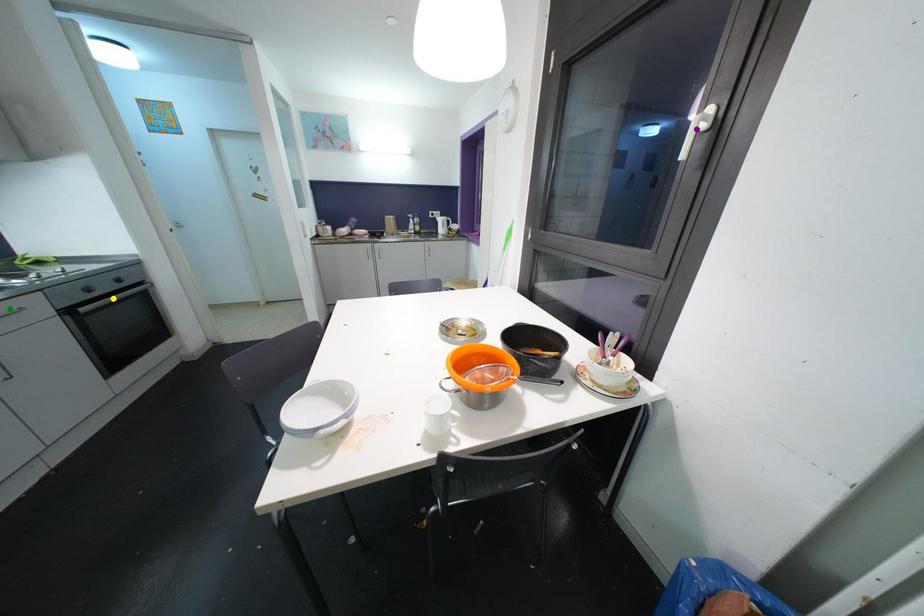
Order these from nearest to farthest:
purple point | green point | yellow point

1. purple point
2. green point
3. yellow point